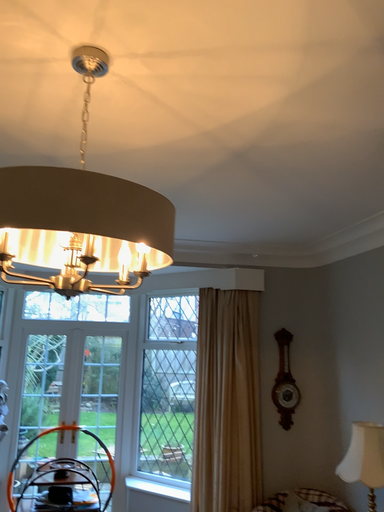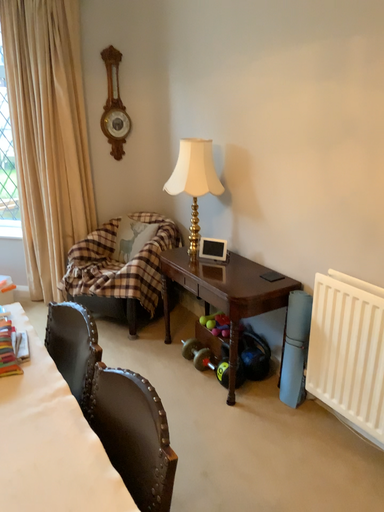
Question: Which way did the camera rotate in the video?

Choices:
 (A) rotated downward
 (B) rotated upward

Answer: (A)